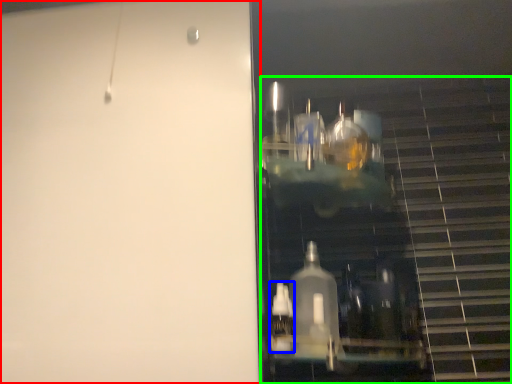
Question: Which object is positioned farthest from door (highlighted by a red box)? Select from bottle (highlighted by a blue box) and stairwell (highlighted by a green box).

Choices:
 (A) bottle
 (B) stairwell

Answer: (A)